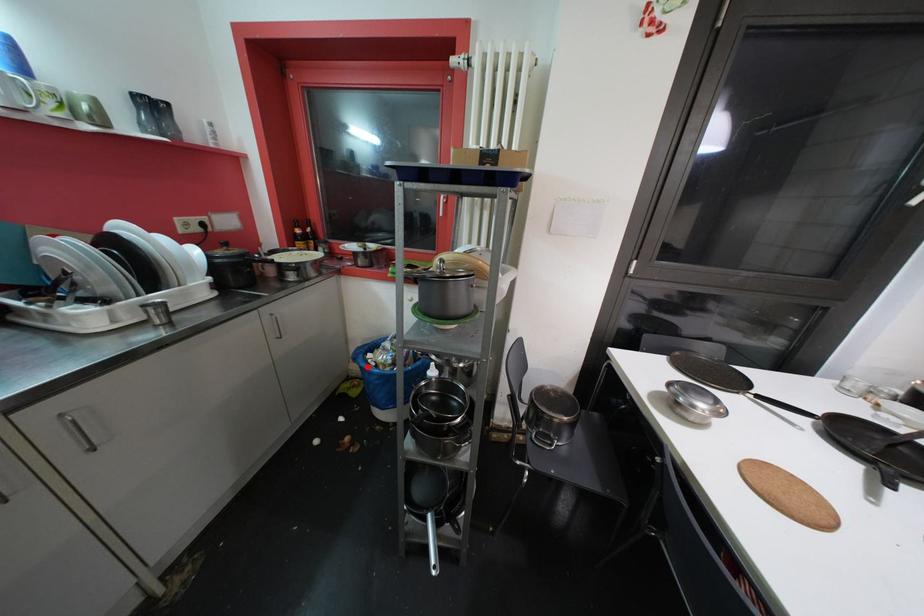
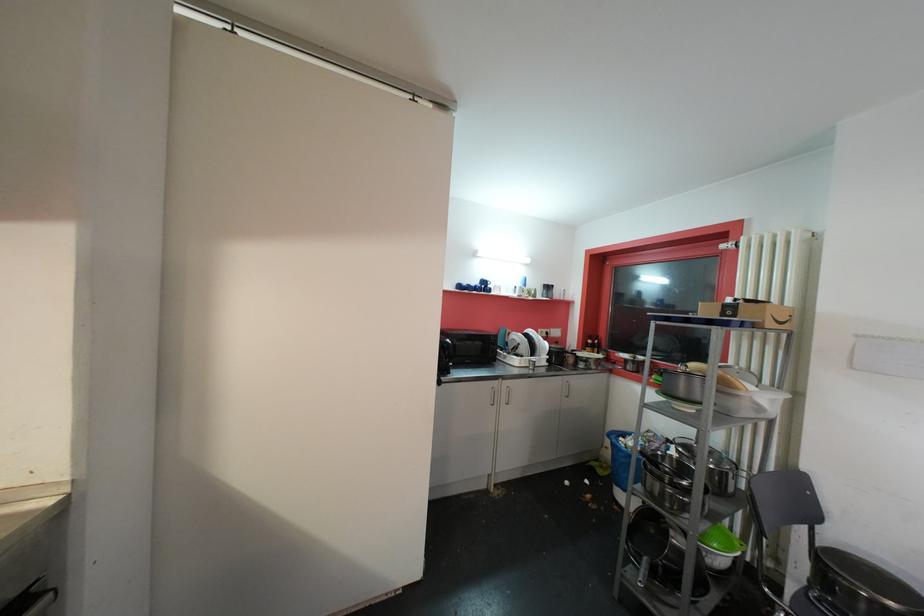
The point at the highlighted location is marked in the first image. Where is the corresponding point in the second image?

(619, 443)